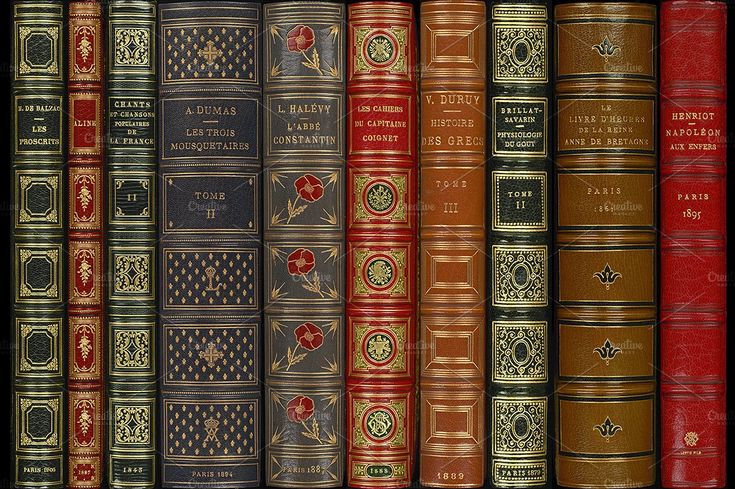
Where is `books`? This screenshot has width=735, height=489. books is located at coordinates click(x=21, y=215), click(x=82, y=229), click(x=115, y=224), click(x=187, y=222), click(x=298, y=236), click(x=376, y=245), click(x=448, y=259), click(x=598, y=266), click(x=517, y=278), click(x=673, y=276).